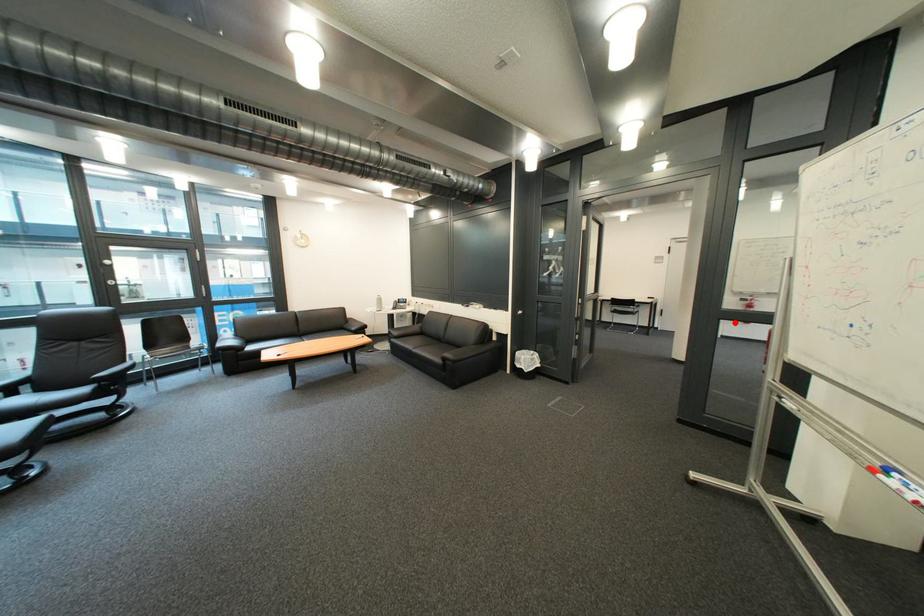
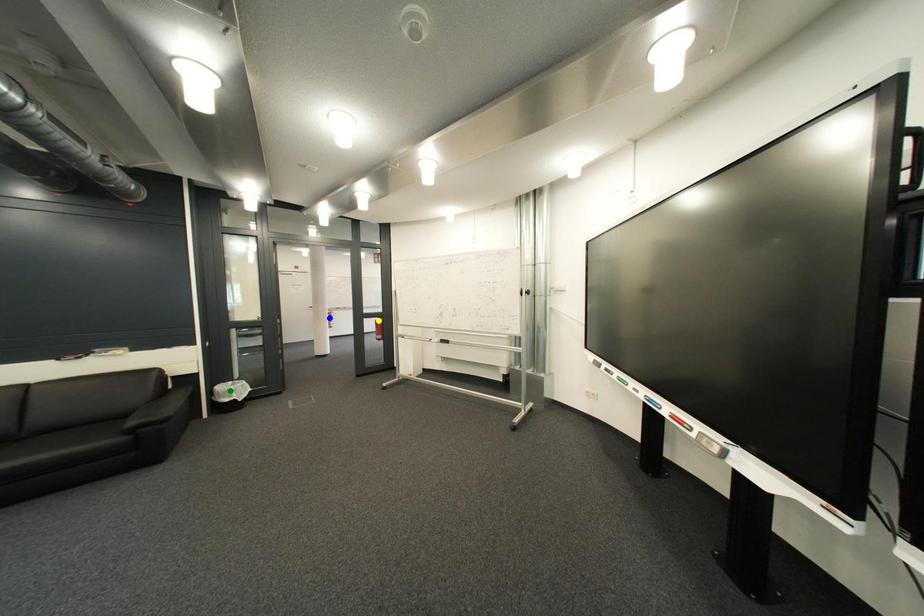
Question: I am providing you with two images of the same scene from different viewpoints. A red point is marked on the first image. You are given multiple points on the second image. Which mark in image 2 goes with the point in image 1?

Choices:
 (A) yellow point
 (B) blue point
 (C) green point

Answer: (A)